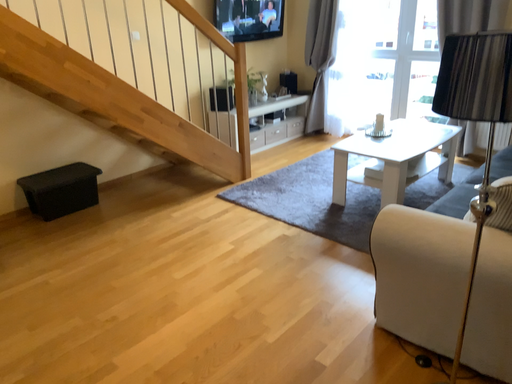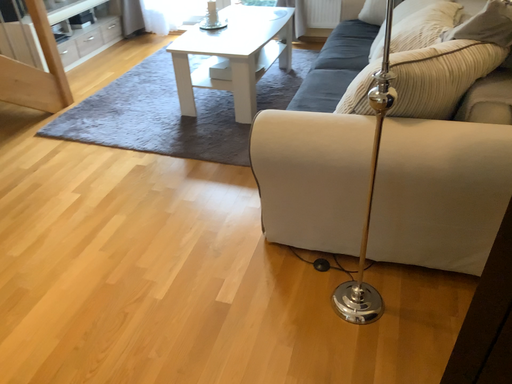
Question: Which way did the camera rotate in the video?

Choices:
 (A) rotated right
 (B) rotated left

Answer: (A)